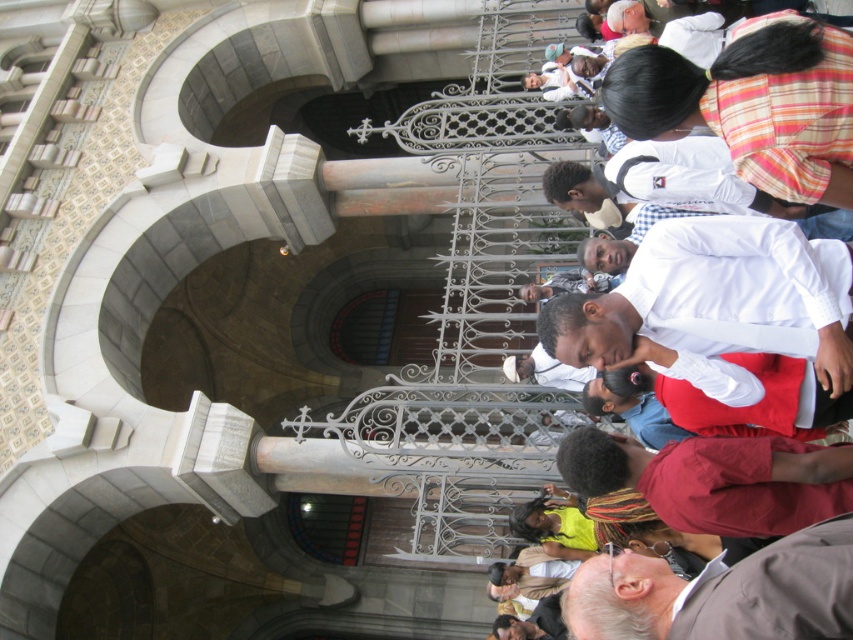
Who is lower down, white cotton shirt at center or gray fabric at lower right?

gray fabric at lower right is lower down.

Who is higher up, white cotton shirt at center or gray fabric at lower right?

white cotton shirt at center is above.

Is point (593, 433) less distant than point (820, 621)?

No, it is behind (820, 621).

This screenshot has height=640, width=853. What are the coordinates of `white cotton shirt at center` in the screenshot? It's located at (729, 67).